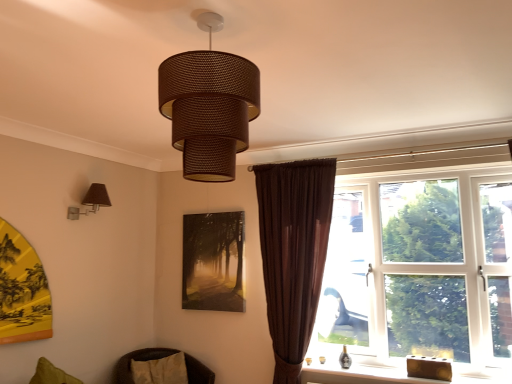
Question: Is brown woven lampshade at center, placed as the first lamp when sorted from top to bottom, at the right side of wooden block at lower right?

Choices:
 (A) yes
 (B) no

Answer: (B)

Question: From the image's perspective, is brown woven lampshade at center, which is the first lamp in front-to-back order, on top of wooden block at lower right?

Choices:
 (A) no
 (B) yes

Answer: (B)

Question: Is brown woven lampshade at center, which is counted as the 2th lamp, starting from the left, taller than wooden block at lower right?

Choices:
 (A) no
 (B) yes

Answer: (B)

Question: From a real-world perspective, is brown woven lampshade at center, the second lamp from the bottom, physically above wooden block at lower right?

Choices:
 (A) no
 (B) yes

Answer: (B)

Question: Is brown woven lampshade at center, placed as the first lamp when sorted from top to bottom, next to wooden block at lower right and touching it?

Choices:
 (A) no
 (B) yes

Answer: (A)

Question: Is brown woven lampshade at center, the second lamp from the bottom, wider than wooden block at lower right?

Choices:
 (A) no
 (B) yes

Answer: (B)

Question: Can you confirm if wooden block at lower right is shorter than brown woven cushion at lower left?

Choices:
 (A) yes
 (B) no

Answer: (A)

Question: From the image's perspective, would you say wooden block at lower right is shown under brown woven cushion at lower left?

Choices:
 (A) yes
 (B) no

Answer: (B)

Question: Does wooden block at lower right have a smaller size compared to brown woven cushion at lower left?

Choices:
 (A) no
 (B) yes

Answer: (B)

Question: Is wooden block at lower right oriented towards brown woven cushion at lower left?

Choices:
 (A) yes
 (B) no

Answer: (B)

Question: Does wooden block at lower right appear on the right side of brown woven cushion at lower left?

Choices:
 (A) yes
 (B) no

Answer: (A)

Question: Is wooden block at lower right at the left side of brown woven cushion at lower left?

Choices:
 (A) no
 (B) yes

Answer: (A)

Question: Considering the relative sizes of brown woven cushion at lower left and matte brown lampshade at left, the second lamp in the front-to-back sequence, in the image provided, is brown woven cushion at lower left thinner than matte brown lampshade at left, the second lamp in the front-to-back sequence,?

Choices:
 (A) yes
 (B) no

Answer: (B)